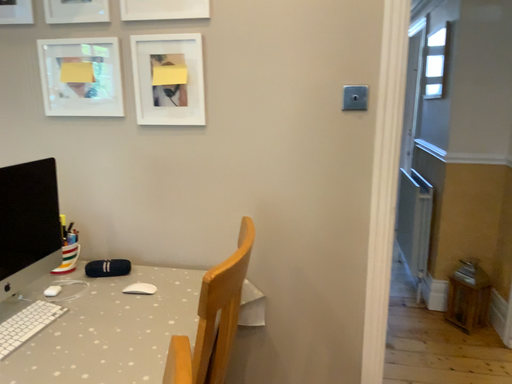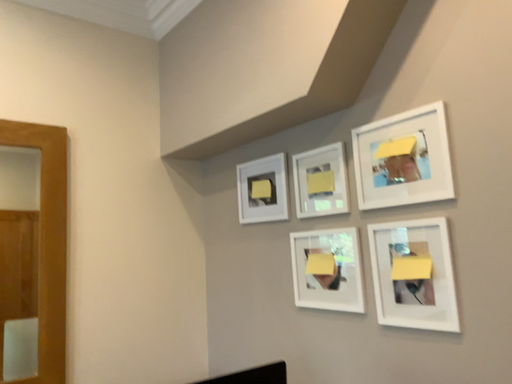
Question: Which way did the camera rotate in the video?

Choices:
 (A) rotated left
 (B) rotated right

Answer: (A)